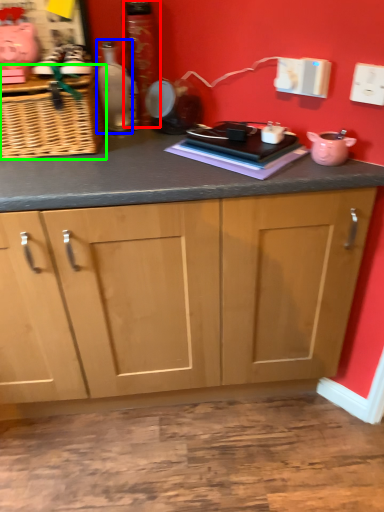
Question: Which object is the farthest from bottle (highlighted by a red box)? Choose among these: bottle (highlighted by a blue box) or basket (highlighted by a green box).

Choices:
 (A) bottle
 (B) basket

Answer: (B)